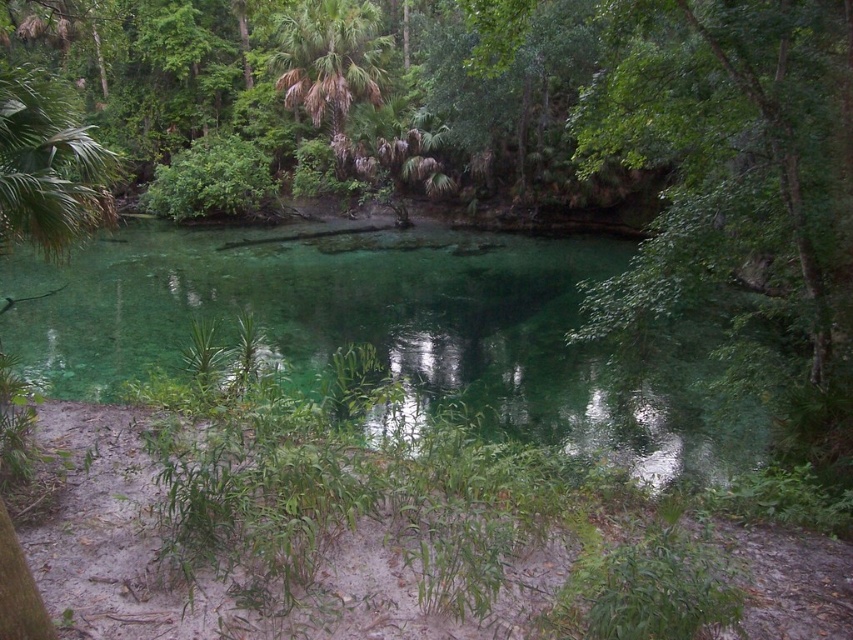
Between clear glassy water at center and green leafy palm tree at upper center, which one has more height?

With more height is clear glassy water at center.

Does point (97, 280) come farther from viewer compared to point (305, 26)?

No.

Does point (171, 232) come in front of point (322, 92)?

That is True.

Find the location of a particular element. clear glassy water at center is located at coordinates (386, 330).

Is point (711, 472) more distant than point (698, 237)?

Yes.

Does clear glassy water at center lie behind green leafy tree at center?

Yes, it is.

Between point (566, 252) and point (643, 156), which one is positioned in front?

Point (643, 156) is more forward.

At what (x,y) coordinates should I click in order to perform the action: click on clear glassy water at center. Please return your answer as a coordinate pair (x, y). Looking at the image, I should click on (386, 330).

Is green leafy tree at center to the left of green leafy palm tree at upper center from the viewer's perspective?

No, green leafy tree at center is not to the left of green leafy palm tree at upper center.

Identify the location of green leafy tree at center. This screenshot has width=853, height=640. (733, 154).

Locate an element on the screen. green leafy tree at center is located at coordinates (733, 154).